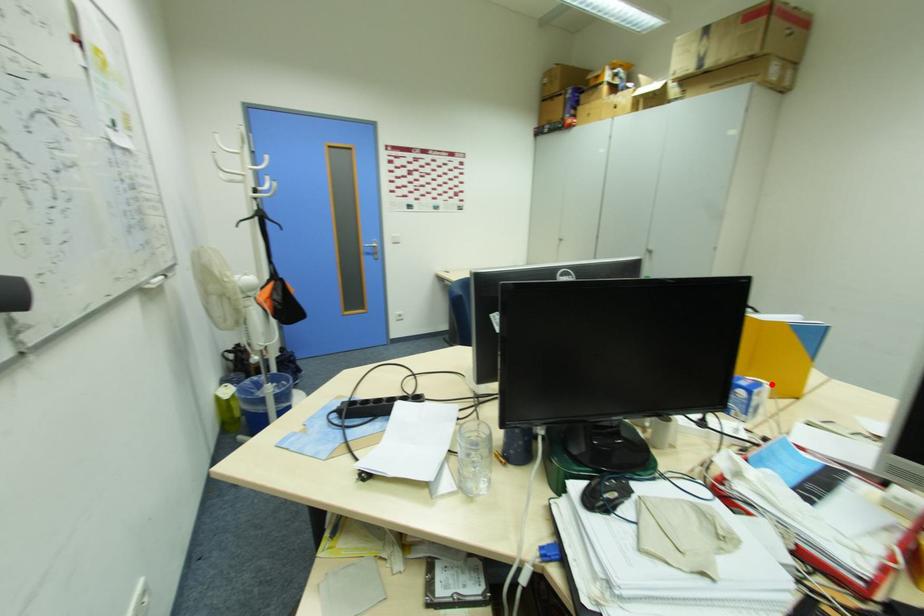
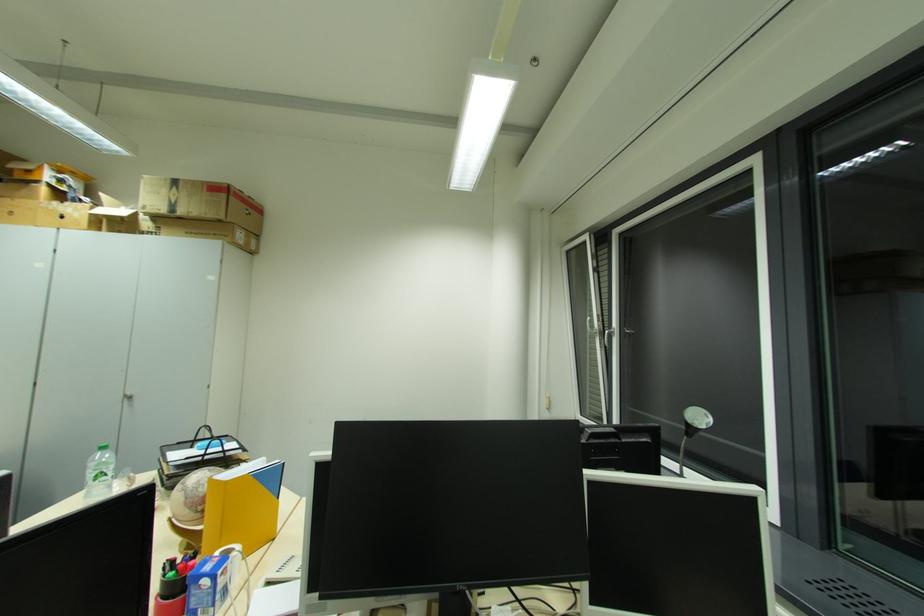
In the second image, find the point that corresponds to the highlighted location in the first image.

(242, 548)